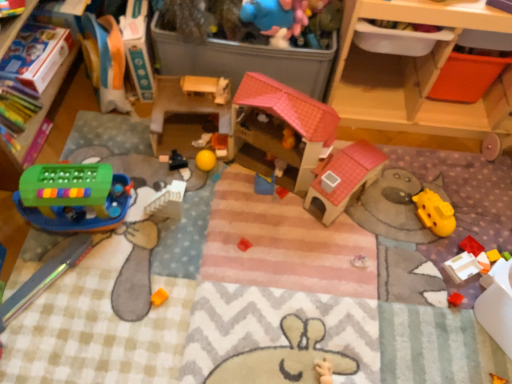
What are the coordinates of `vacant space to the right of bright red plastic block at lower right, which appears as the first toy when viewed from the right` in the screenshot? It's located at (495, 236).